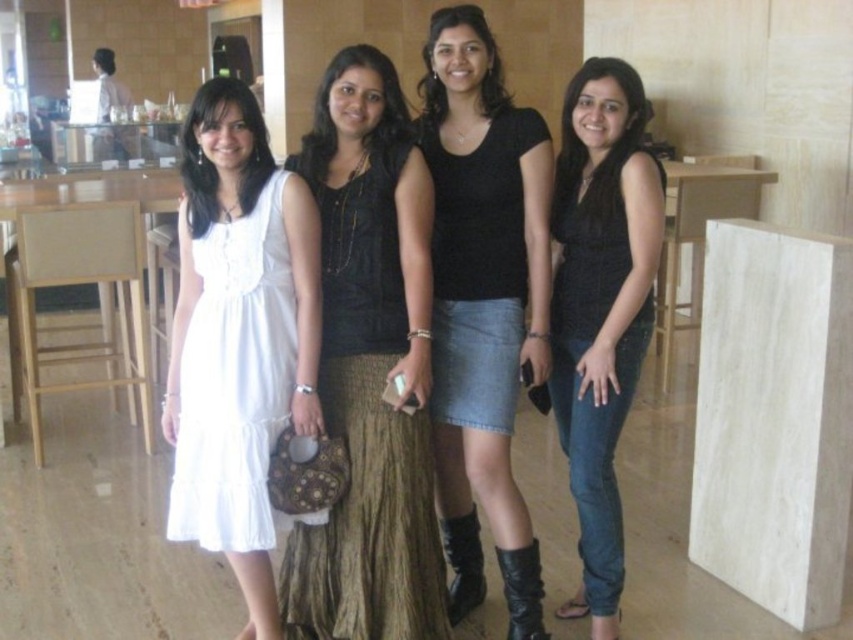
You are a photographer setting up for a group photo. You have a camera that can focus on items up to 1.2 meters wide. You see the brown textured skirt at center and the white satin dress at left in your frame. Can both items fit within the camera focus area if placed side by side?

The brown textured skirt at center is wider than the white satin dress at left. Since their combined width would exceed 1.2 meters, they cannot both fit within the camera focus area when placed side by side.